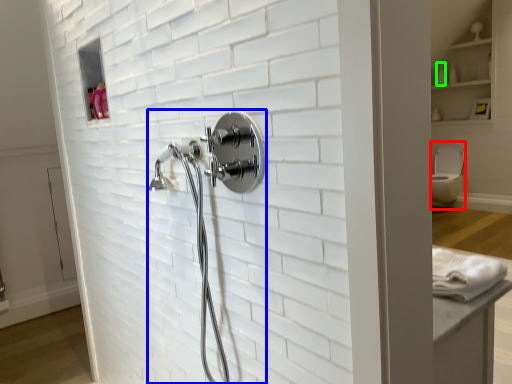
Question: Considering the real-world distances, which object is farthest from toilet bowl (highlighted by a red box)? shower (highlighted by a blue box) or toiletry (highlighted by a green box)?

Choices:
 (A) shower
 (B) toiletry

Answer: (A)